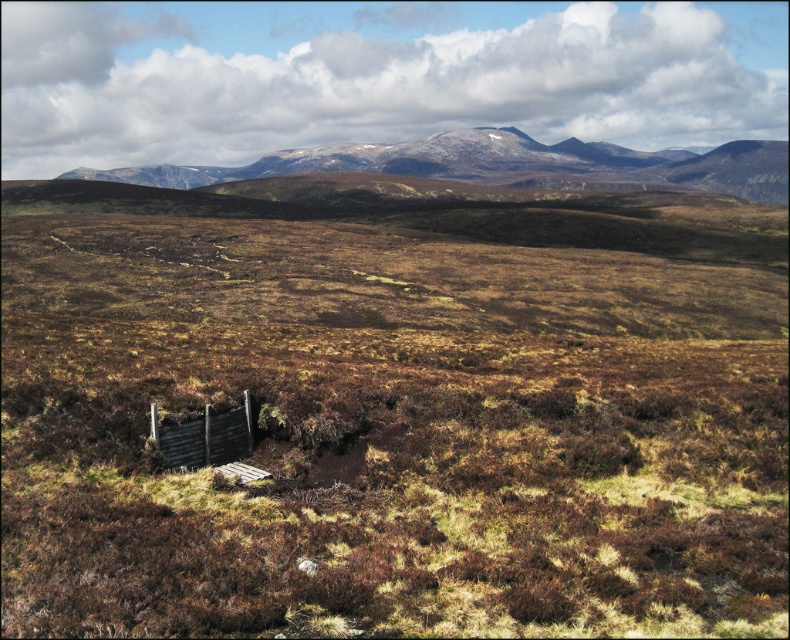
You are a hiker who wants to reach the rugged brown mountain at upper center from the wooden fence at lower center. Given that your average walking speed is 5 km per hour, how long would it take you to walk directly to the mountain?

The distance between rugged brown mountain at upper center and wooden fence at lower center is 386.33 meters. At a speed of 5 km per hour, it would take approximately 4.6 minutes to walk directly to the mountain.

What are the coordinates of the rugged brown mountain at upper center in the image?

The rugged brown mountain at upper center is located at coordinates point (x=503, y=164).